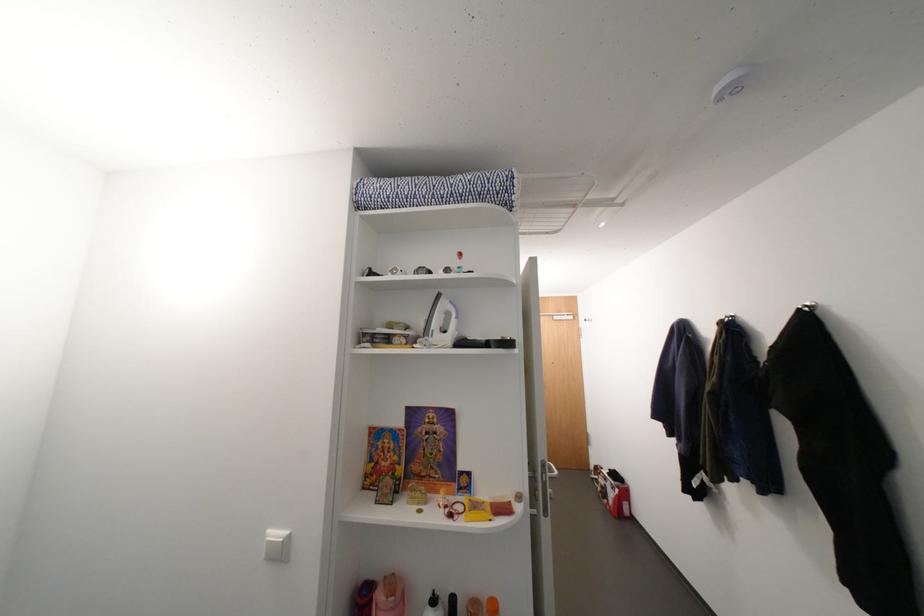
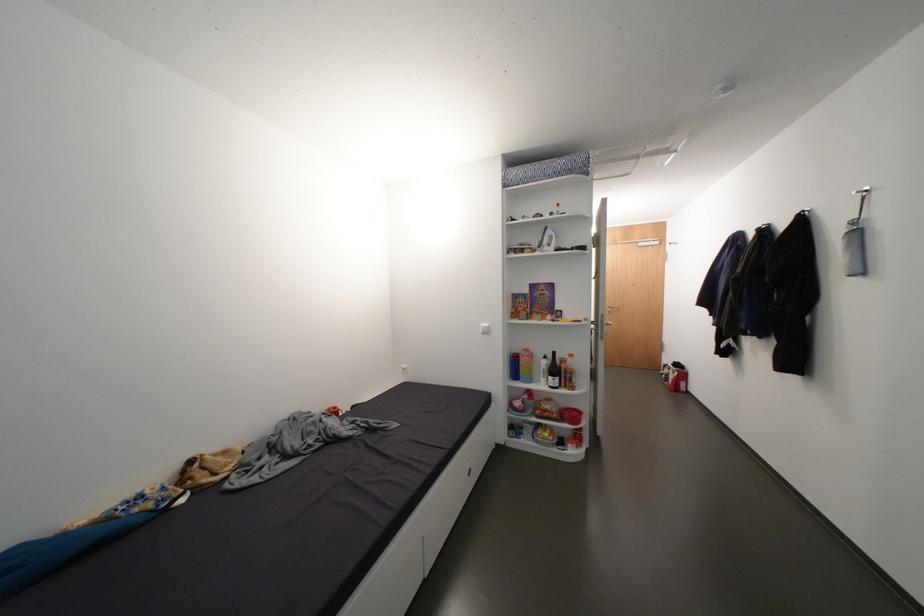
Find the pixel in the second image that matches (x=444, y=326) in the first image.

(553, 243)